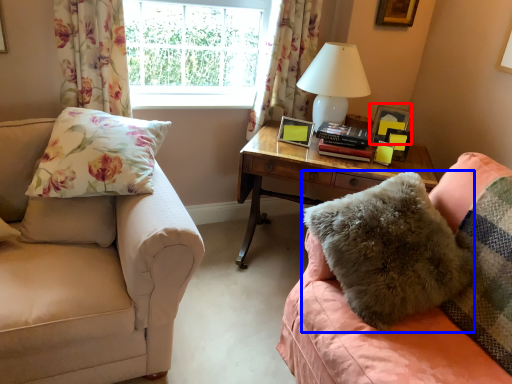
Question: Among these objects, which one is farthest to the camera, picture frame (highlighted by a red box) or pillow (highlighted by a blue box)?

Choices:
 (A) picture frame
 (B) pillow

Answer: (A)